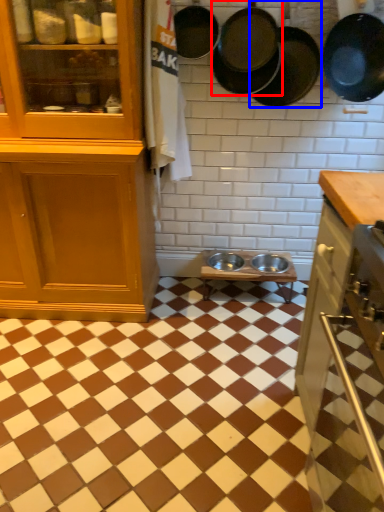
Question: Among these objects, which one is farthest to the camera, frying pan (highlighted by a red box) or frying pan (highlighted by a blue box)?

Choices:
 (A) frying pan
 (B) frying pan

Answer: (A)